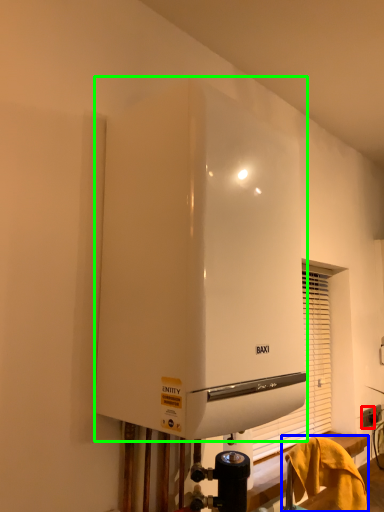
Question: Based on their relative distances, which object is farther from electric outlet (highlighted by a red box)? Choose from furniture (highlighted by a blue box) and home appliance (highlighted by a green box).

Choices:
 (A) furniture
 (B) home appliance

Answer: (B)